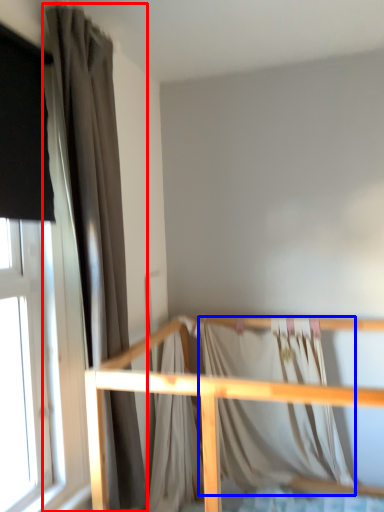
Question: Which object is further to the camera taking this photo, curtain (highlighted by a red box) or blanket (highlighted by a blue box)?

Choices:
 (A) curtain
 (B) blanket

Answer: (B)